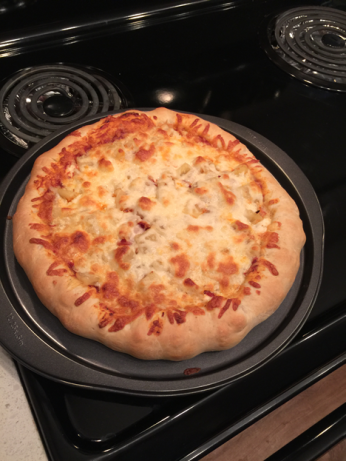
Image resolution: width=346 pixels, height=461 pixels. What are the coordinates of `oven top` in the screenshot? It's located at (319, 321).